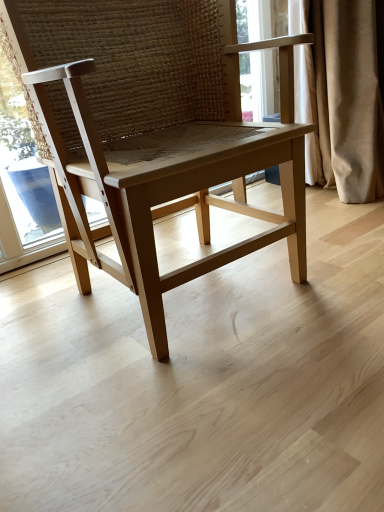
Locate an element on the screen. This screenshot has width=384, height=512. vacant space in front of beige velvet curtain at right is located at coordinates (346, 224).